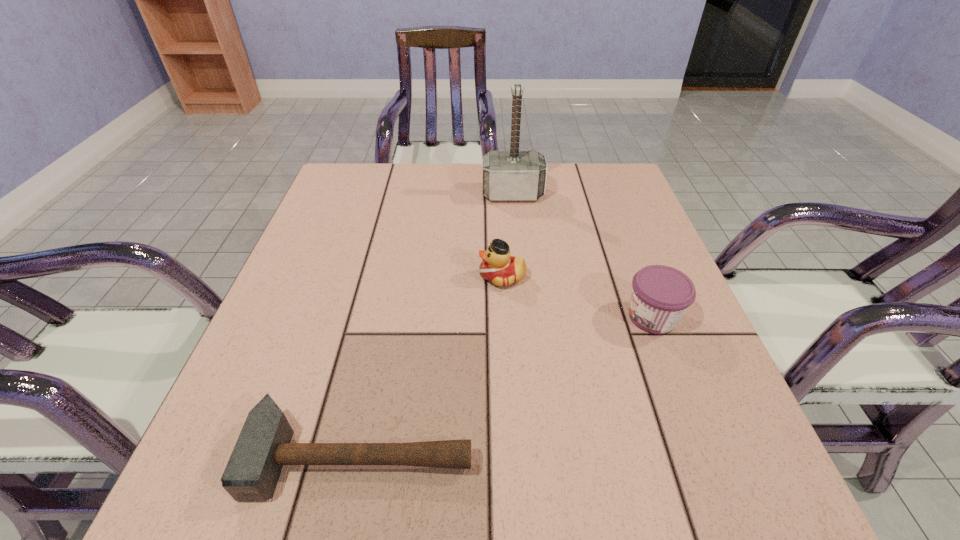
You are a GUI agent. You are given a task and a screenshot of the screen. Output one action in this format:
    pyautogui.click(x=<x>, y=<y>)
    Task: Click on the vacant position in the image that satisfies the following two spatial constraints: 1. on the face of the duck; 2. on the striking surface of the shorter hammer
    The image size is (960, 540).
    Given the screenshot: What is the action you would take?
    pyautogui.click(x=512, y=455)

Where is `vacant area in the image that satisfies the following two spatial constraints: 1. for striking with the head of the tallest object; 2. on the face of the duck`? The image size is (960, 540). vacant area in the image that satisfies the following two spatial constraints: 1. for striking with the head of the tallest object; 2. on the face of the duck is located at coordinates (521, 276).

You are a GUI agent. You are given a task and a screenshot of the screen. Output one action in this format:
    pyautogui.click(x=<x>, y=<y>)
    Task: Click on the vacant region that satisfies the following two spatial constraints: 1. on the front label of the rightmost object; 2. on the striking surface of the shorter hammer
    The width and height of the screenshot is (960, 540).
    Given the screenshot: What is the action you would take?
    pyautogui.click(x=705, y=455)

You are a GUI agent. You are given a task and a screenshot of the screen. Output one action in this format:
    pyautogui.click(x=<x>, y=<y>)
    Task: Click on the free spot that satisfies the following two spatial constraints: 1. for striking with the head of the farther hammer; 2. on the face of the second farthest object
    
    Given the screenshot: What is the action you would take?
    pyautogui.click(x=521, y=276)

The height and width of the screenshot is (540, 960). I want to click on vacant space that satisfies the following two spatial constraints: 1. on the face of the second farthest object; 2. on the striking surface of the leftmost object, so click(512, 455).

You are a GUI agent. You are given a task and a screenshot of the screen. Output one action in this format:
    pyautogui.click(x=<x>, y=<y>)
    Task: Click on the free space in the image that satisfies the following two spatial constraints: 1. on the face of the second farthest object; 2. on the striking surface of the left hammer
    Image resolution: width=960 pixels, height=540 pixels.
    Given the screenshot: What is the action you would take?
    pyautogui.click(x=512, y=455)